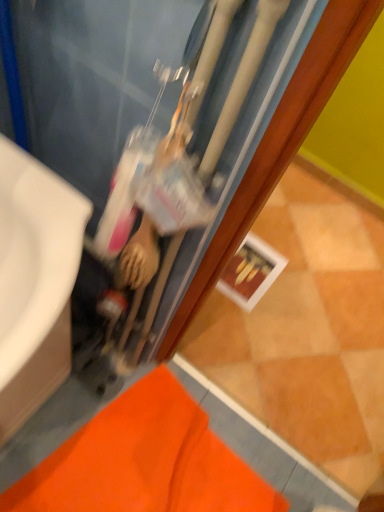
Question: From the image's perspective, relative to matte black water heater at center, is white glossy sink at left above or below?

Choices:
 (A) below
 (B) above

Answer: (A)

Question: Considering the positions of point (81, 224) and point (137, 77), is point (81, 224) closer or farther from the camera than point (137, 77)?

Choices:
 (A) farther
 (B) closer

Answer: (B)

Question: Based on their relative distances, which object is farther from the white glossy sink at left?

Choices:
 (A) matte black water heater at center
 (B) orange fabric bath mat at lower left

Answer: (B)

Question: Which of these objects is positioned farthest from the orange fabric bath mat at lower left?

Choices:
 (A) matte black water heater at center
 (B) white glossy sink at left

Answer: (B)